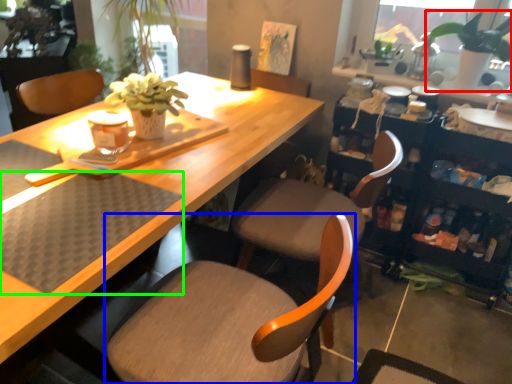
Question: Estimate the real-world distances between objects in this image. Which object is farther from houseplant (highlighted by a red box), chair (highlighted by a blue box) or wide (highlighted by a green box)?

Choices:
 (A) chair
 (B) wide

Answer: (B)